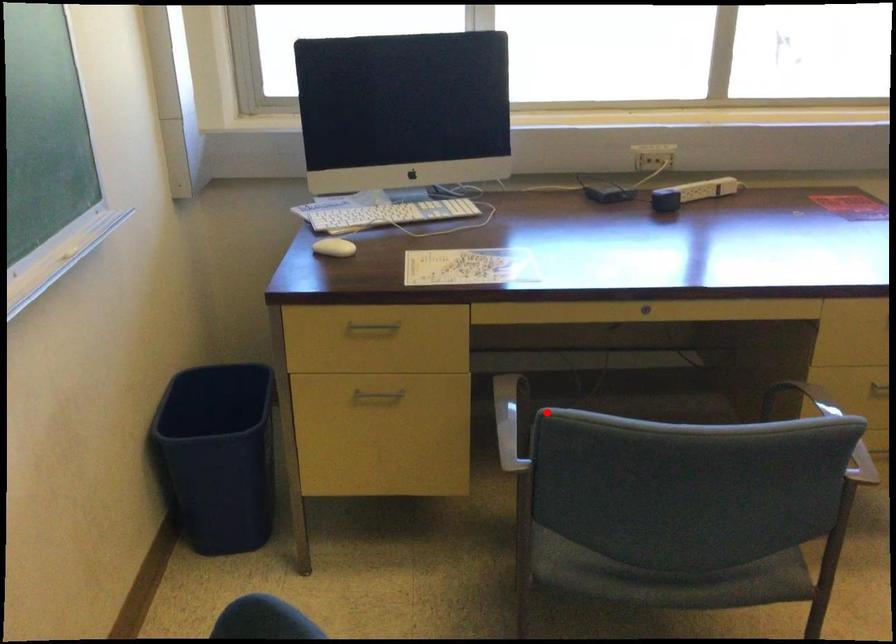
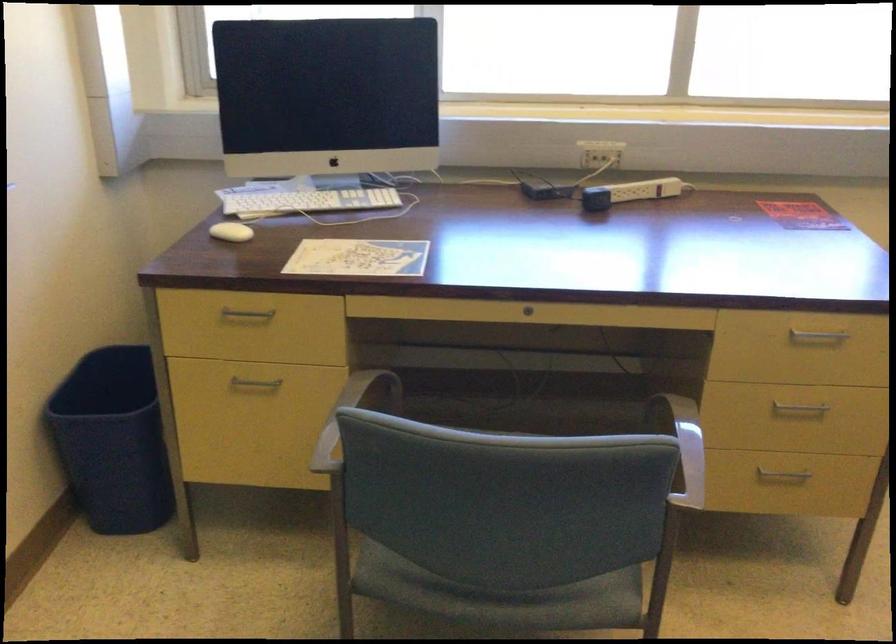
Find the pixel in the second image that matches the highlighted location in the first image.

(350, 415)